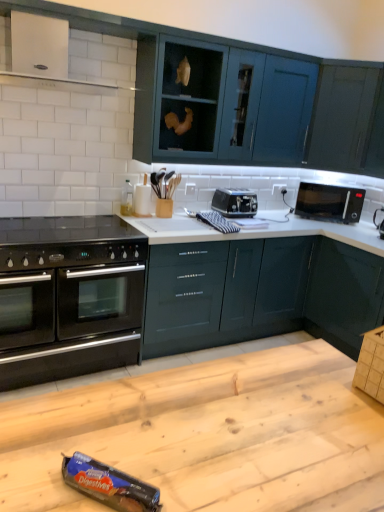
Where is `free space behind blue cardboard digestives at lower center, which is the first appliance in bottom-to-top order`? The width and height of the screenshot is (384, 512). free space behind blue cardboard digestives at lower center, which is the first appliance in bottom-to-top order is located at coordinates (131, 439).